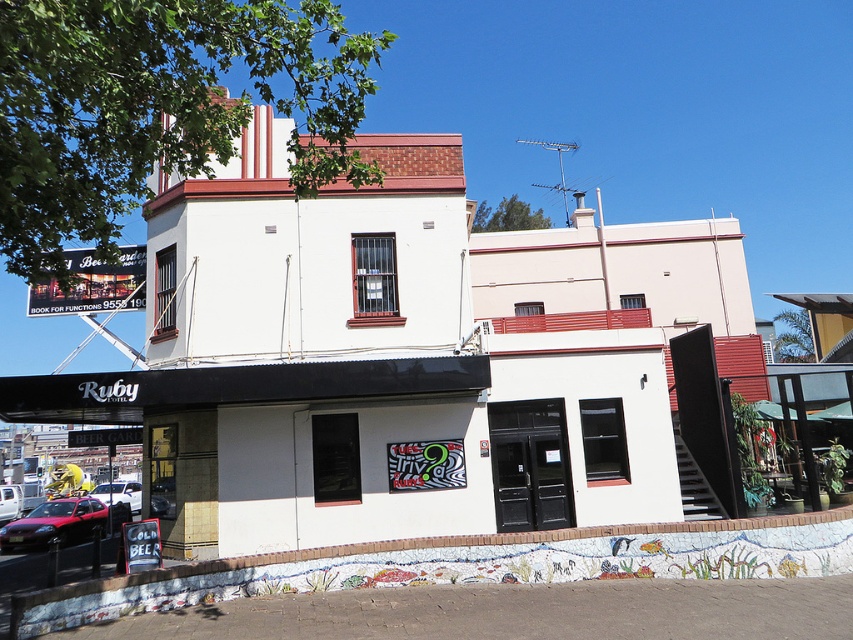
You are standing at the entrance of the Ruby building and want to park your car, which is 5 meters long, in a spot that is exactly 20 meters away from the entrance. Is the matte red car at lower left positioned in a place that could be suitable for your parking needs?

The matte red car at lower left is 20.02 meters from viewer, which is very close to the desired 20 meters distance. Since your car is 5 meters long, the spot where the matte red car at lower left is parked might be suitable as it meets the distance requirement, but you should ensure there is enough space for your car length.

You are standing at the entrance of the building named Ruby. You want to park your matte red car at lower left in a parking spot that is located at coordinates 0.820, 0.066. Is the car already parked in the correct spot?

The matte red car at lower left is located exactly at point (55, 524), so yes, the car is already parked in the correct spot.

You are a delivery driver arriving at the Ruby building. You need to park your vehicle between the two red cars visible in the scene. Can you fit your truck, which is 6 meters long, between the matte red car at lower left and the metallic red car at center?

The matte red car at lower left is located above the metallic red car at center, meaning there is no horizontal space between them for the truck to park. Therefore, the truck cannot fit between them.